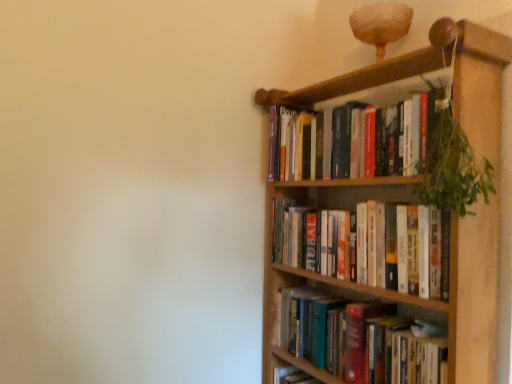
Question: From a real-world perspective, is hardcover books at right, marked as the 1th book in a bottom-to-top arrangement, physically above wooden bookcase at upper right?

Choices:
 (A) yes
 (B) no

Answer: (B)

Question: Is hardcover books at right, marked as the 1th book in a bottom-to-top arrangement, at the right side of wooden bookcase at upper right?

Choices:
 (A) no
 (B) yes

Answer: (B)

Question: From the image's perspective, does hardcover books at right, marked as the third book in a top-to-bottom arrangement, appear lower than wooden bookcase at upper right?

Choices:
 (A) yes
 (B) no

Answer: (A)

Question: Can you confirm if hardcover books at right, marked as the third book in a top-to-bottom arrangement, is taller than wooden bookcase at upper right?

Choices:
 (A) yes
 (B) no

Answer: (B)

Question: Can you confirm if hardcover books at right, marked as the 1th book in a bottom-to-top arrangement, is wider than wooden bookcase at upper right?

Choices:
 (A) yes
 (B) no

Answer: (B)

Question: From the image's perspective, is hardcover books at upper right, which appears as the 2th book when viewed from the top, positioned above or below hardcover books at right, marked as the third book in a top-to-bottom arrangement?

Choices:
 (A) above
 (B) below

Answer: (A)

Question: Based on their sizes in the image, would you say hardcover books at upper right, the 2th book positioned from the bottom, is bigger or smaller than hardcover books at right, marked as the third book in a top-to-bottom arrangement?

Choices:
 (A) big
 (B) small

Answer: (A)

Question: In the image, is hardcover books at upper right, which appears as the 2th book when viewed from the top, on the left side or the right side of hardcover books at right, marked as the third book in a top-to-bottom arrangement?

Choices:
 (A) left
 (B) right

Answer: (A)

Question: Is point (402, 238) closer or farther from the camera than point (352, 329)?

Choices:
 (A) farther
 (B) closer

Answer: (B)

Question: In terms of width, does hardcover books at upper right, the 3th book in the bottom-to-top sequence, look wider or thinner when compared to green leafy plant at upper right?

Choices:
 (A) thin
 (B) wide

Answer: (A)

Question: From a real-world perspective, is hardcover books at upper right, the 3th book in the bottom-to-top sequence, positioned above or below green leafy plant at upper right?

Choices:
 (A) above
 (B) below

Answer: (A)

Question: Choose the correct answer: Is hardcover books at upper right, which is the 1th book in top-to-bottom order, inside green leafy plant at upper right or outside it?

Choices:
 (A) outside
 (B) inside

Answer: (A)

Question: Visually, is hardcover books at upper right, which is the 1th book in top-to-bottom order, positioned to the left or to the right of green leafy plant at upper right?

Choices:
 (A) left
 (B) right

Answer: (A)

Question: Looking at the image, does wooden bookcase at upper right seem bigger or smaller compared to hardcover books at upper right, which is the 1th book in top-to-bottom order?

Choices:
 (A) small
 (B) big

Answer: (B)

Question: From the image's perspective, relative to hardcover books at upper right, which is the 1th book in top-to-bottom order, is wooden bookcase at upper right above or below?

Choices:
 (A) above
 (B) below

Answer: (B)